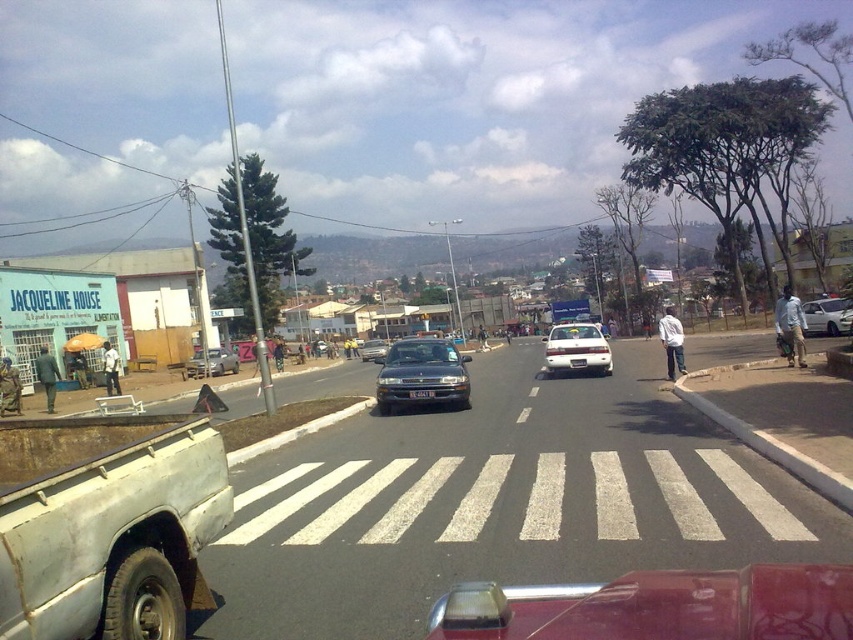
Is light blue shirt at right thinner than metallic silver car at center?

Indeed, light blue shirt at right has a lesser width compared to metallic silver car at center.

Does point (799, 333) come behind point (190, 356)?

No, it is in front of (190, 356).

At what (x,y) coordinates should I click in order to perform the action: click on light blue shirt at right. Please return your answer as a coordinate pair (x, y). The image size is (853, 640). Looking at the image, I should click on (790, 326).

Between point (39, 349) and point (115, 380), which one is positioned behind?

Point (39, 349)

Is point (45, 369) farther from viewer compared to point (119, 360)?

No, (45, 369) is closer to viewer.

Is point (44, 369) less distant than point (119, 356)?

Yes, point (44, 369) is in front of point (119, 356).

The height and width of the screenshot is (640, 853). I want to click on green matte jacket at left, so click(47, 376).

Can you confirm if light brown leather jacket at center is bigger than black plastic license plate at center?

Yes.

Is point (106, 381) farther from camera compared to point (418, 394)?

Yes, point (106, 381) is farther from viewer.

You are a GUI agent. You are given a task and a screenshot of the screen. Output one action in this format:
    pyautogui.click(x=<x>, y=<y>)
    Task: Click on the light brown leather jacket at center
    This screenshot has height=640, width=853.
    Given the screenshot: What is the action you would take?
    pyautogui.click(x=109, y=369)